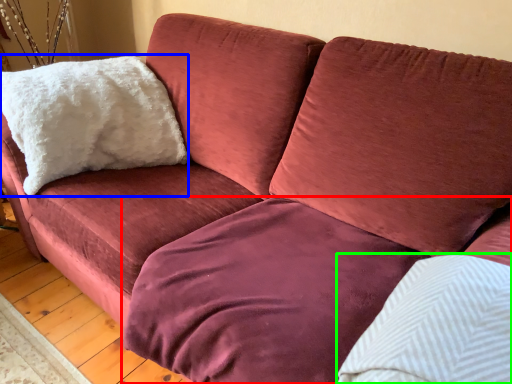
Question: Considering the real-world distances, which object is closest to bedding (highlighted by a red box)? pillow (highlighted by a blue box) or pillow (highlighted by a green box).

Choices:
 (A) pillow
 (B) pillow

Answer: (B)